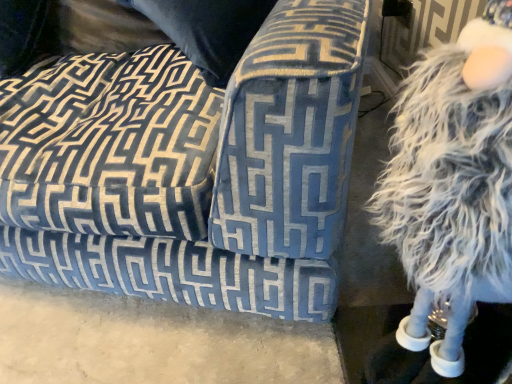
What do you see at coordinates (452, 183) in the screenshot? The height and width of the screenshot is (384, 512). I see `white fluffy figurine at right` at bounding box center [452, 183].

Identify the location of white fluffy figurine at right. The image size is (512, 384). (452, 183).

Measure the distance between point (233, 206) and camera.

A distance of 26.93 inches exists between point (233, 206) and camera.

Find the location of a particular element. The height and width of the screenshot is (384, 512). velvet blue couch at center is located at coordinates (189, 168).

Image resolution: width=512 pixels, height=384 pixels. Describe the element at coordinates (189, 168) in the screenshot. I see `velvet blue couch at center` at that location.

Where is `white fluffy figurine at right`? white fluffy figurine at right is located at coordinates (452, 183).

Can you confirm if white fluffy figurine at right is positioned to the left of velvet blue couch at center?

Incorrect, white fluffy figurine at right is not on the left side of velvet blue couch at center.

Is white fluffy figurine at right positioned before velvet blue couch at center?

Yes, the depth of white fluffy figurine at right is less than that of velvet blue couch at center.

Is point (465, 155) farther from camera compared to point (329, 182)?

No, (465, 155) is closer to viewer.

From the image's perspective, which one is positioned lower, white fluffy figurine at right or velvet blue couch at center?

white fluffy figurine at right is shown below in the image.

From the picture: From a real-world perspective, who is located higher, white fluffy figurine at right or velvet blue couch at center?

white fluffy figurine at right.

Considering the relative sizes of white fluffy figurine at right and velvet blue couch at center in the image provided, is white fluffy figurine at right thinner than velvet blue couch at center?

Correct, the width of white fluffy figurine at right is less than that of velvet blue couch at center.

Who is shorter, white fluffy figurine at right or velvet blue couch at center?

velvet blue couch at center is shorter.

Who is bigger, white fluffy figurine at right or velvet blue couch at center?

velvet blue couch at center.

Is velvet blue couch at center completely or partially inside white fluffy figurine at right?

No, velvet blue couch at center is not inside white fluffy figurine at right.

Is white fluffy figurine at right beside velvet blue couch at center?

No, white fluffy figurine at right is not making contact with velvet blue couch at center.

Is white fluffy figurine at right turned away from velvet blue couch at center?

No, white fluffy figurine at right is not facing away from velvet blue couch at center.

How many degrees apart are the facing directions of white fluffy figurine at right and velvet blue couch at center?

73.4 degrees separate the facing orientations of white fluffy figurine at right and velvet blue couch at center.

At what (x,y) coordinates should I click in order to perform the action: click on figurine above the velvet blue couch at center (from a real-world perspective). Please return your answer as a coordinate pair (x, y). Looking at the image, I should click on (452, 183).

Which object is positioned more to the left, velvet blue couch at center or white fluffy figurine at right?

velvet blue couch at center is more to the left.

Is velvet blue couch at center closer to the viewer compared to white fluffy figurine at right?

No, velvet blue couch at center is further to the viewer.

Considering the positions of points (59, 236) and (468, 188), is point (59, 236) closer to camera compared to point (468, 188)?

No, (59, 236) is further to viewer.

From the image's perspective, is velvet blue couch at center below white fluffy figurine at right?

No, from the image's perspective, velvet blue couch at center is not beneath white fluffy figurine at right.

From a real-world perspective, is velvet blue couch at center on top of white fluffy figurine at right?

No, from a real-world perspective, velvet blue couch at center is not on top of white fluffy figurine at right.

Between velvet blue couch at center and white fluffy figurine at right, which one has smaller width?

With smaller width is white fluffy figurine at right.

From their relative heights in the image, would you say velvet blue couch at center is taller or shorter than white fluffy figurine at right?

Clearly, velvet blue couch at center is shorter compared to white fluffy figurine at right.

Based on their sizes in the image, would you say velvet blue couch at center is bigger or smaller than white fluffy figurine at right?

In the image, velvet blue couch at center appears to be larger than white fluffy figurine at right.

Do you think velvet blue couch at center is within white fluffy figurine at right, or outside of it?

velvet blue couch at center cannot be found inside white fluffy figurine at right.

Is velvet blue couch at center beside white fluffy figurine at right?

No, velvet blue couch at center is not making contact with white fluffy figurine at right.

Is white fluffy figurine at right at the back of velvet blue couch at center?

velvet blue couch at center is not turned away from white fluffy figurine at right.

How many degrees apart are the facing directions of velvet blue couch at center and white fluffy figurine at right?

73.4 degrees.

Measure the distance between velvet blue couch at center and white fluffy figurine at right.

velvet blue couch at center and white fluffy figurine at right are 14.05 inches apart from each other.

I want to click on studio couch above the white fluffy figurine at right (from the image's perspective), so click(189, 168).

You are a GUI agent. You are given a task and a screenshot of the screen. Output one action in this format:
    pyautogui.click(x=<x>, y=<y>)
    Task: Click on the studio couch located underneath the white fluffy figurine at right (from a real-world perspective)
    The width and height of the screenshot is (512, 384).
    Given the screenshot: What is the action you would take?
    pyautogui.click(x=189, y=168)

There is a velvet blue couch at center. Identify the location of figurine above it (from a real-world perspective). (452, 183).